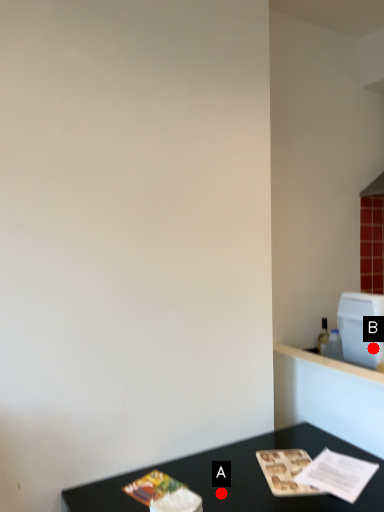
Question: Two points are circled on the image, labeled by A and B beside each circle. Among these points, which one is nearest to the camera?

Choices:
 (A) A is closer
 (B) B is closer

Answer: (A)